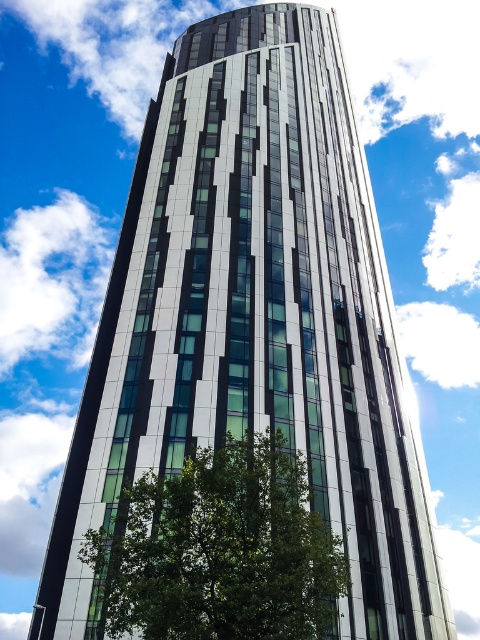
From the picture: You are standing in front of the modern building and want to take a photo. There are two points marked on the building facade at coordinates point (26,323) and point (425,369). Which point will appear closer to you in the photo?

Point (26,323) is further to the camera than point (425,369), so in the photo, point (26,323) will appear closer to you.

You are standing in front of a modern building and see a point marked at coordinates (52, 278). What object is located at that point?

The point at (52, 278) corresponds to the white fluffy cloud at upper left.

You are an architect analyzing the building in the image. You notice the green leafy tree at lower center and the white fluffy cloud at upper left. Which object is closer to the ground?

The green leafy tree at lower center is closer to the ground because it is positioned under the white fluffy cloud at upper left.